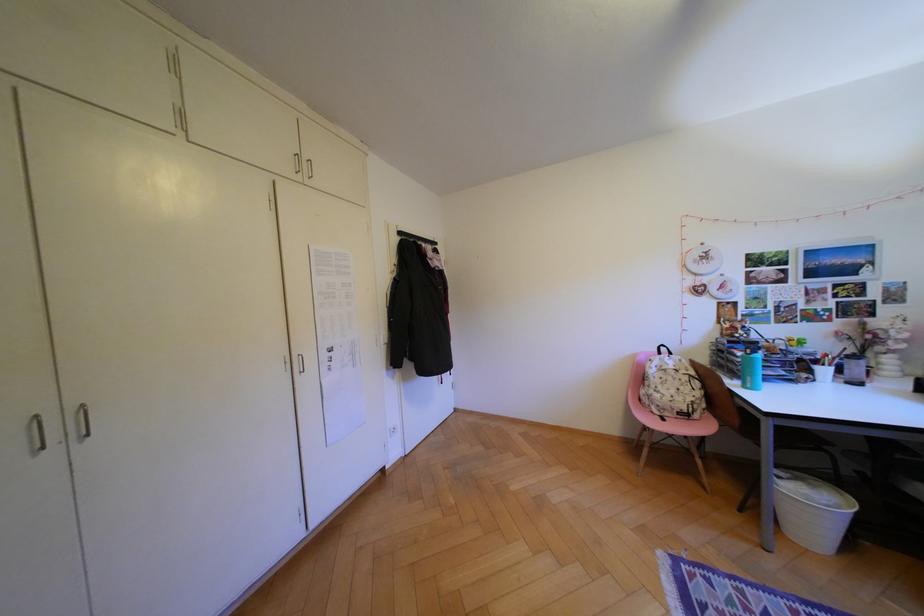
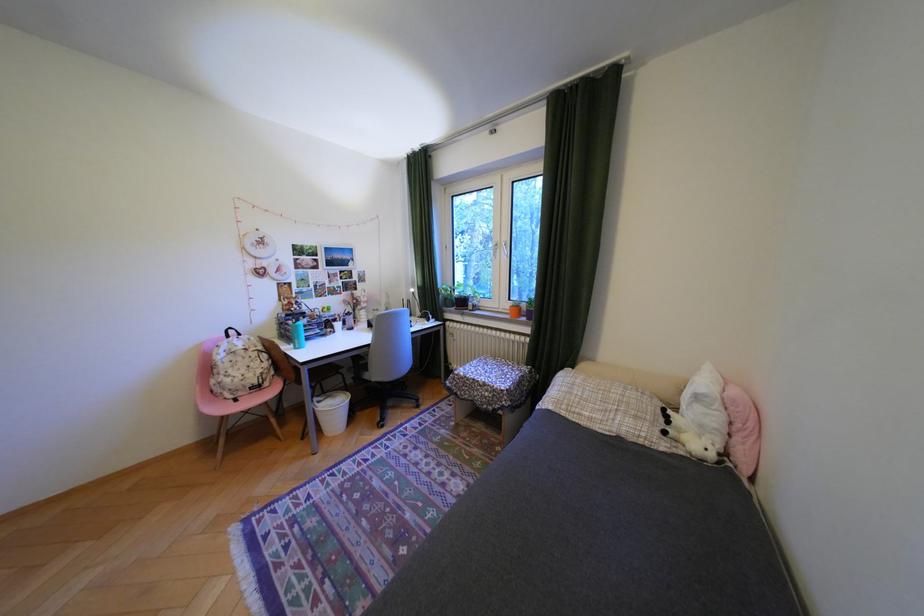
Find the pixel in the second image that matches (x=678, y=414) in the first image.

(251, 394)